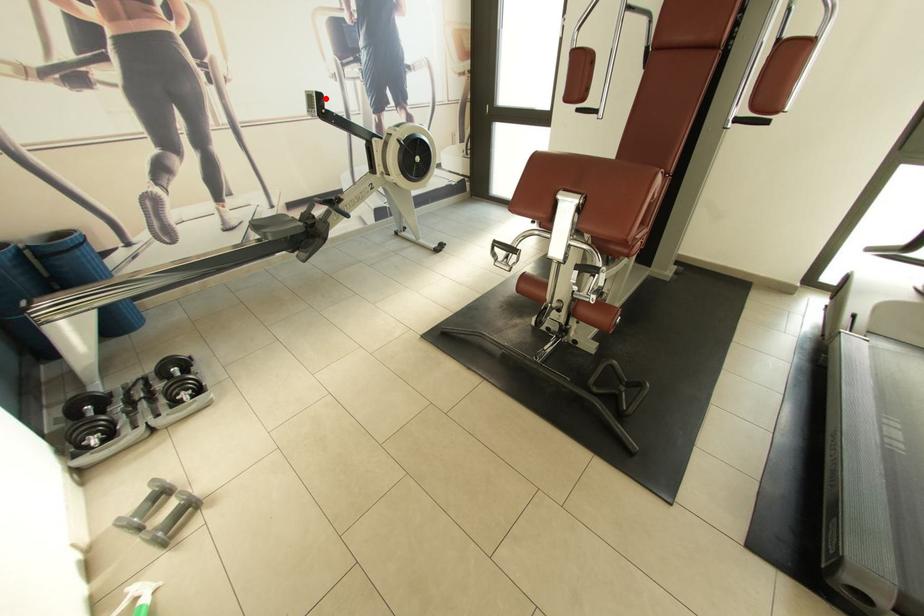
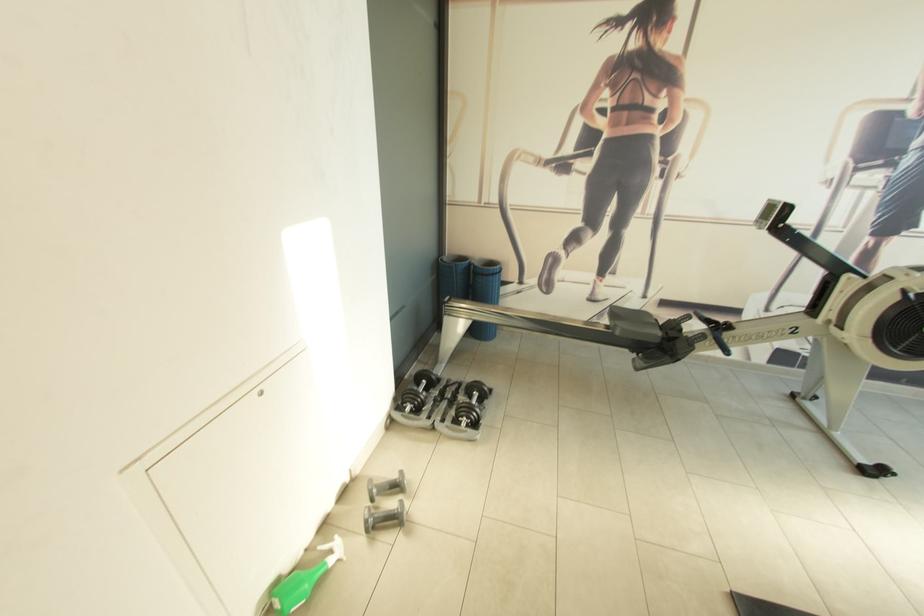
In the second image, find the point that corresponds to the highlighted location in the first image.

(792, 209)